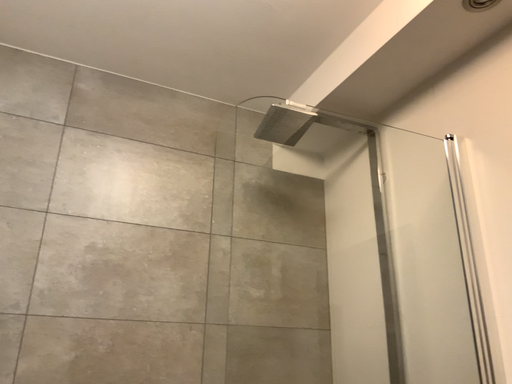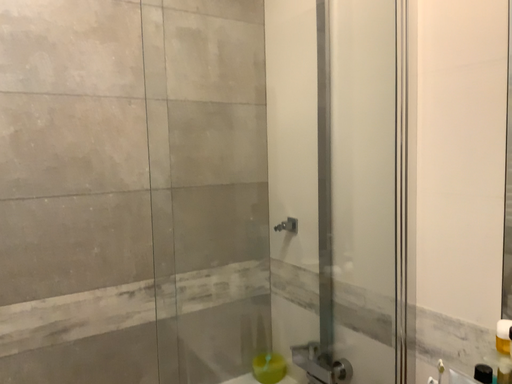
Question: How did the camera likely rotate when shooting the video?

Choices:
 (A) rotated downward
 (B) rotated upward

Answer: (A)